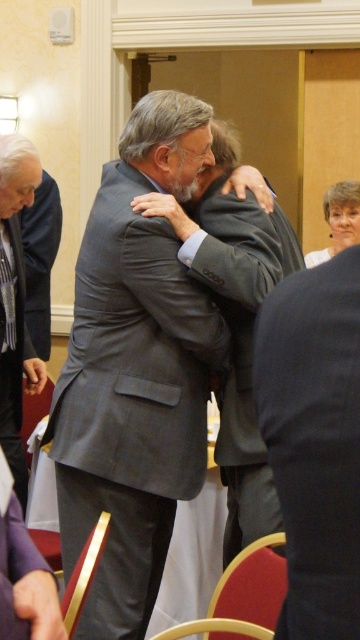
Question: Does gray suit at center have a lesser width compared to gray wool suit at left?

Choices:
 (A) no
 (B) yes

Answer: (A)

Question: Which point is farther to the camera?

Choices:
 (A) (176, 451)
 (B) (347, 557)
 (C) (18, 282)
 (D) (199, 209)

Answer: (C)

Question: Which point is closer to the camera?

Choices:
 (A) (7, 403)
 (B) (69, 420)
 (C) (358, 541)
 (D) (259, 477)

Answer: (C)

Question: Is gray suit at center smaller than gray wool business suit at center?

Choices:
 (A) no
 (B) yes

Answer: (A)

Question: Does dark gray fabric business suit at center have a greater width compared to gray wool business suit at center?

Choices:
 (A) yes
 (B) no

Answer: (B)

Question: Which object is closer to the camera taking this photo?

Choices:
 (A) dark gray fabric business suit at center
 (B) gray wool suit at left

Answer: (A)